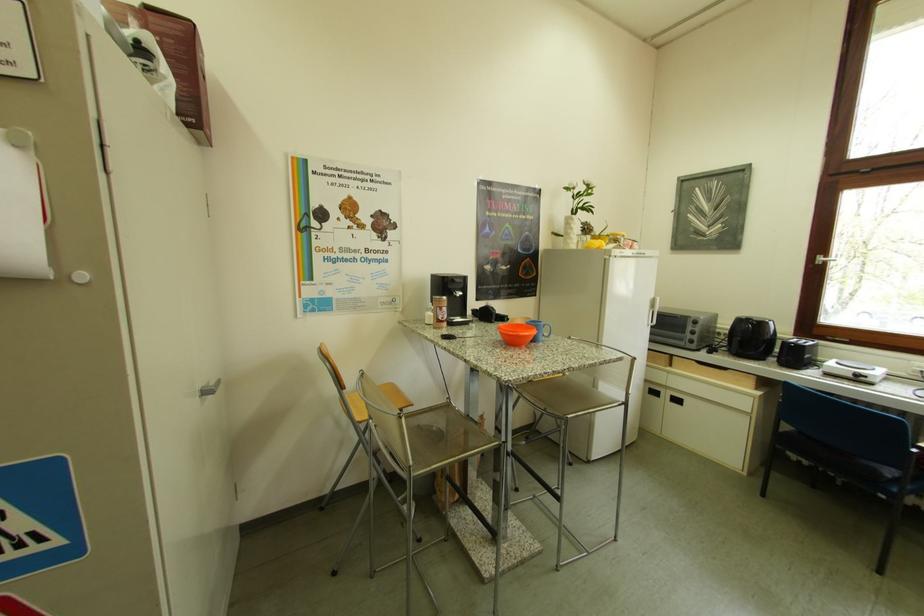
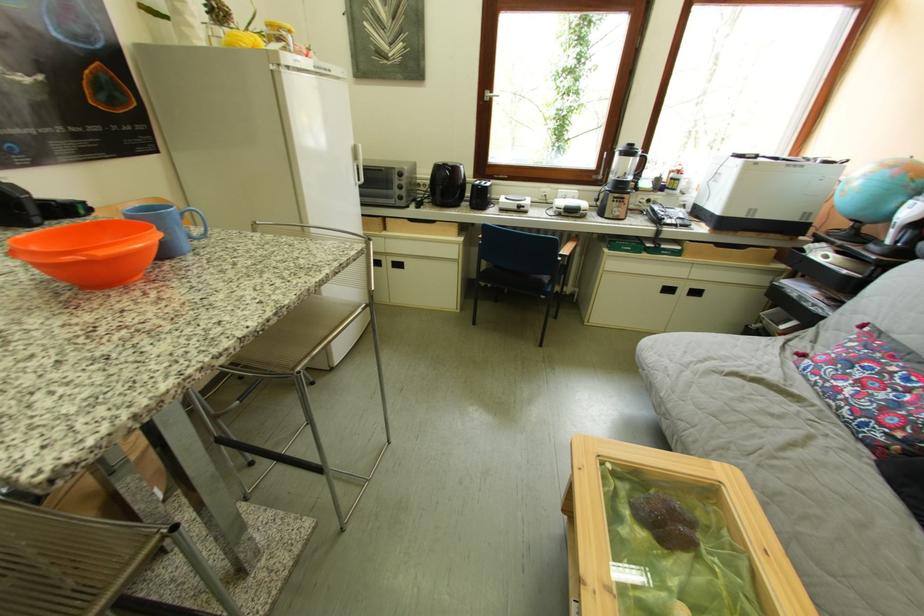
Locate, in the second image, the point that corresponds to [754,325] in the first image.

(451, 171)